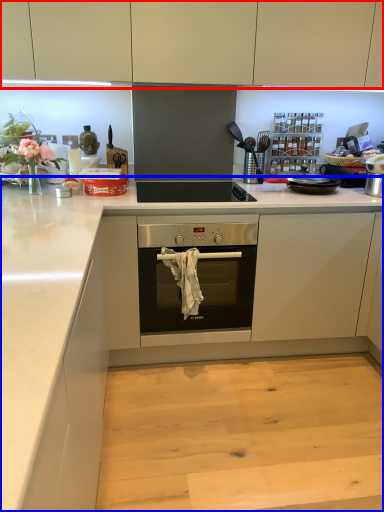
Question: Among these objects, which one is nearest to the camera, cabinetry (highlighted by a red box) or countertop (highlighted by a blue box)?

Choices:
 (A) cabinetry
 (B) countertop

Answer: (A)